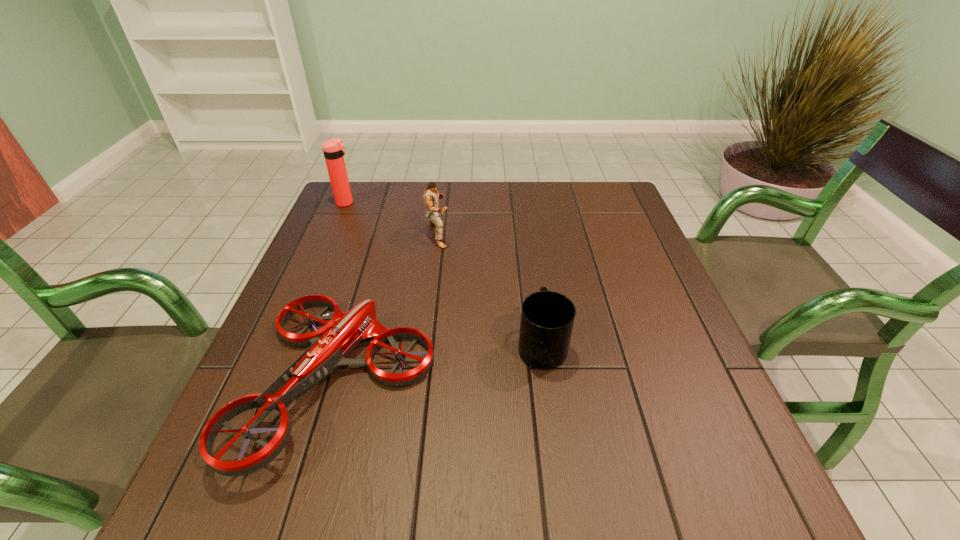
You are a GUI agent. You are given a task and a screenshot of the screen. Output one action in this format:
    pyautogui.click(x=<x>, y=<y>)
    Task: Click on the free location that satisfies the following two spatial constraints: 1. on the front-facing side of the second tallest object; 2. on the side of the mug with the handle
    The image size is (960, 540).
    Given the screenshot: What is the action you would take?
    pyautogui.click(x=424, y=345)

Where is `vacant space that satisfies the following two spatial constraints: 1. on the front-facing side of the third shortest object; 2. on the side of the mug with the handle`? vacant space that satisfies the following two spatial constraints: 1. on the front-facing side of the third shortest object; 2. on the side of the mug with the handle is located at coordinates (424, 345).